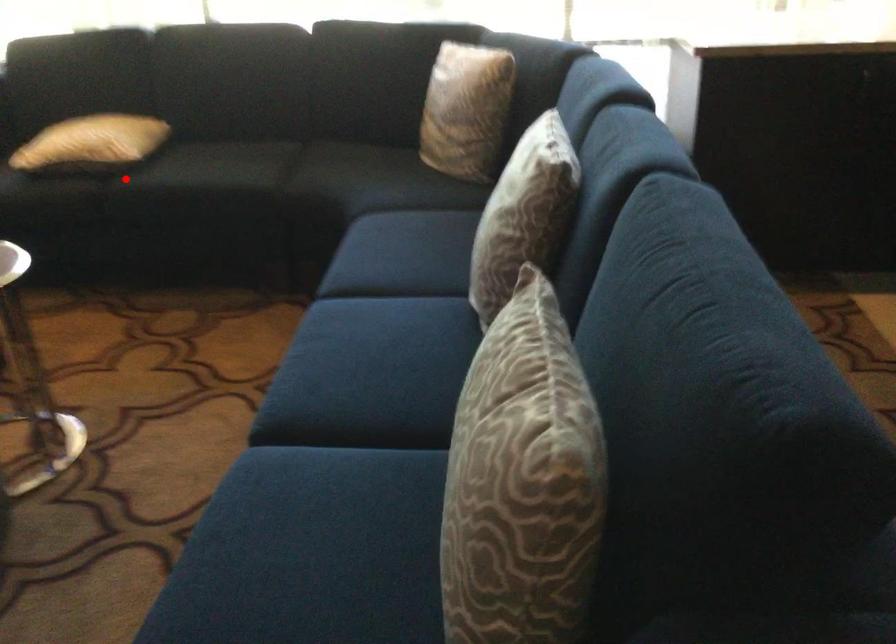
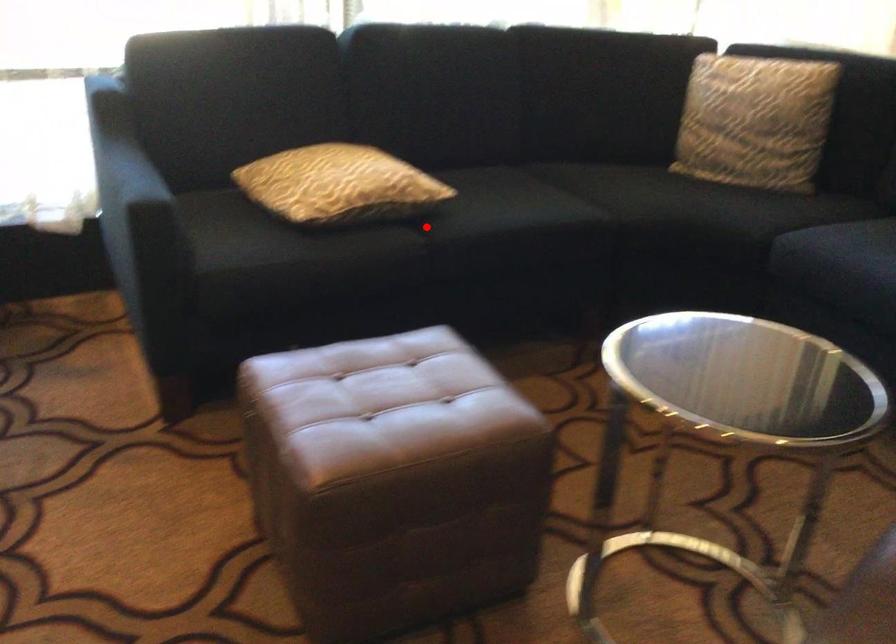
I am providing you with two images of the same scene from different viewpoints. A red point is marked on the first image and another point is marked on the second image. Does the point marked in image1 correspond to the same location as the one in image2?

Yes